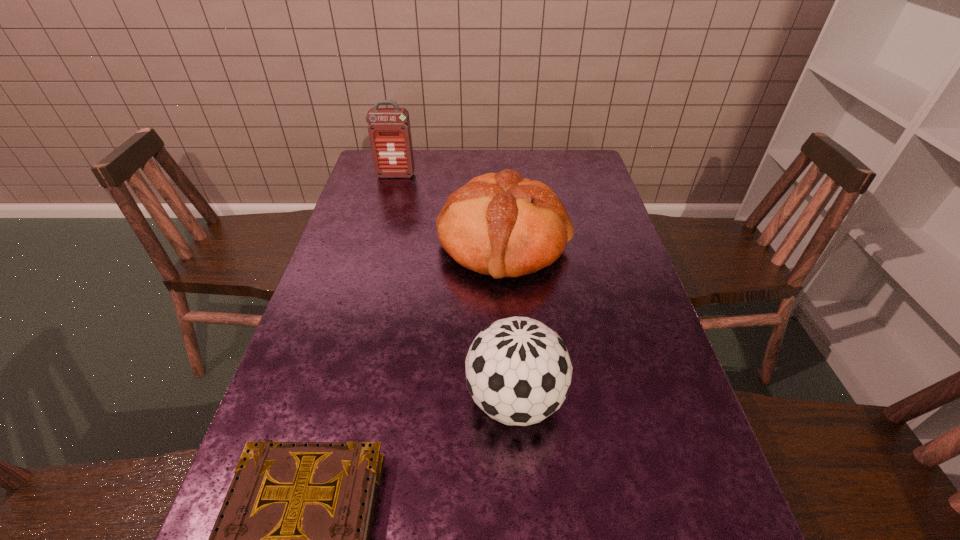
Locate an element on the screen. object that is positioned at the far left corner is located at coordinates (389, 130).

Where is `free space at the far edge`? free space at the far edge is located at coordinates (477, 151).

You are a GUI agent. You are given a task and a screenshot of the screen. Output one action in this format:
    pyautogui.click(x=<x>, y=<y>)
    Task: Click on the vacant space at the left edge of the desktop
    
    Given the screenshot: What is the action you would take?
    pyautogui.click(x=375, y=248)

At what (x,y) coordinates should I click in order to perform the action: click on vacant area at the right edge of the desktop. Please return your answer as a coordinate pair (x, y). The image size is (960, 540). Looking at the image, I should click on (684, 459).

You are a GUI agent. You are given a task and a screenshot of the screen. Output one action in this format:
    pyautogui.click(x=<x>, y=<y>)
    Task: Click on the vacant region between the farthest object and the third farthest object
    The image size is (960, 540).
    Given the screenshot: What is the action you would take?
    pyautogui.click(x=456, y=287)

At what (x,y) coordinates should I click in order to perform the action: click on vacant space that's between the soccer ball and the tallest object. Please return your answer as a coordinate pair (x, y). This screenshot has width=960, height=540. Looking at the image, I should click on (456, 287).

I want to click on object that is the second closest to the tallest object, so click(518, 371).

At what (x,y) coordinates should I click in order to perform the action: click on object that is the second nearest to the first-aid kit. Please return your answer as a coordinate pair (x, y). This screenshot has width=960, height=540. Looking at the image, I should click on (518, 371).

Where is `free region that satisfies the following two spatial constraints: 1. on the front-facing side of the second nearest object; 2. on the left side of the farthest object`? free region that satisfies the following two spatial constraints: 1. on the front-facing side of the second nearest object; 2. on the left side of the farthest object is located at coordinates click(x=335, y=400).

Locate an element on the screen. free region that satisfies the following two spatial constraints: 1. on the front-facing side of the second farthest object; 2. on the left side of the first-aid kit is located at coordinates (377, 244).